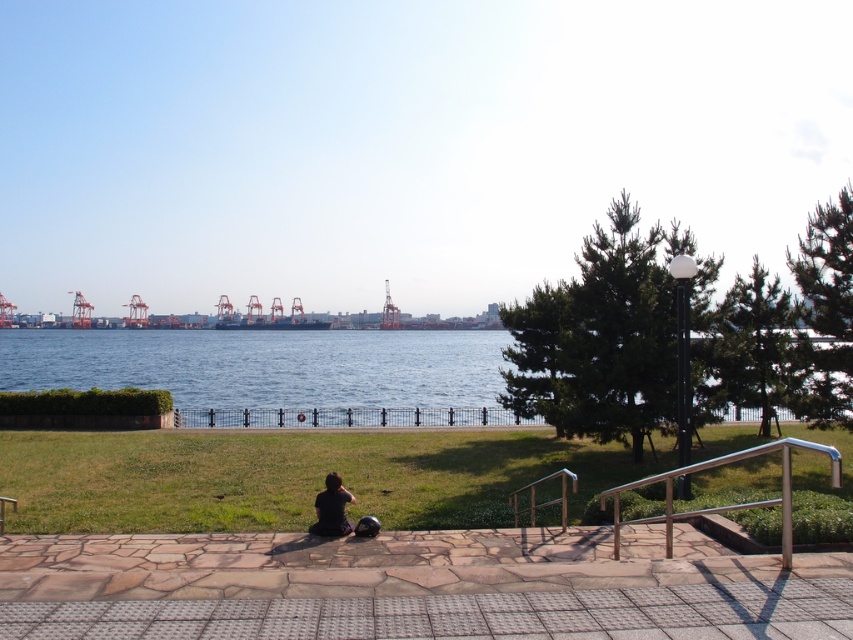
You are standing at the point closer to the camera between point [247,424] and point [338,506]. You want to walk to the point further away. Which point should you walk towards?

You should walk towards point [338,506] because point [247,424] is closer to the camera than point [338,506].

Based on the scene description, where is the blue water at center located in terms of coordinates?

The blue water at center is located at coordinates point [276,372].

You are a photographer trying to capture the blue water at center and the black fabric person at center in a single shot. Based on their positions, which object will appear larger in the photo?

The blue water at center will appear larger in the photo because it is taller than the black fabric person at center.